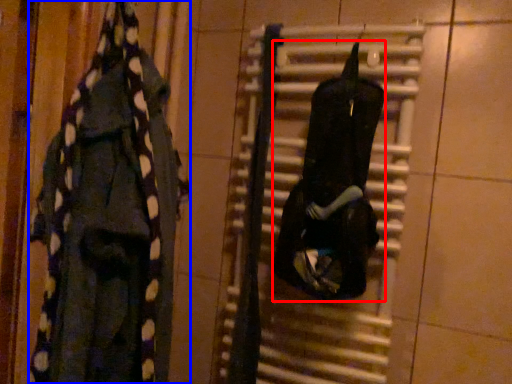
Question: Which of the following is the farthest to the observer, clothing (highlighted by a red box) or clothing (highlighted by a blue box)?

Choices:
 (A) clothing
 (B) clothing

Answer: (A)